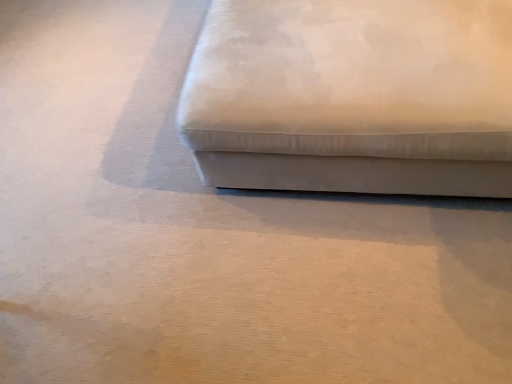
Locate an element on the screen. The height and width of the screenshot is (384, 512). beige velvet ottoman at upper center is located at coordinates (353, 97).

Looking at this image, measure the distance between beige velvet ottoman at upper center and camera.

They are 1.03 meters apart.

Describe the element at coordinates (353, 97) in the screenshot. I see `beige velvet ottoman at upper center` at that location.

The height and width of the screenshot is (384, 512). I want to click on beige velvet ottoman at upper center, so click(x=353, y=97).